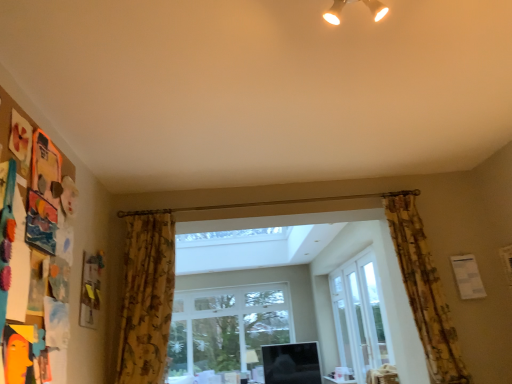
Question: In the image, is floral fabric curtain at right, marked as the 1th curtain in a right-to-left arrangement, positioned in front of or behind clear glass window at center, the first window from the left?

Choices:
 (A) behind
 (B) front

Answer: (B)

Question: Is floral fabric curtain at right, the 2th curtain from the left, taller or shorter than clear glass window at center, the first window from the left?

Choices:
 (A) short
 (B) tall

Answer: (A)

Question: Estimate the real-world distances between objects in this image. Which object is farther from the floral fabric curtain at left, marked as the second curtain in a right-to-left arrangement?

Choices:
 (A) white glossy spotlights at upper center
 (B) white glass door at center, arranged as the first window when viewed from the front
 (C) floral fabric curtain at right, marked as the 1th curtain in a right-to-left arrangement
 (D) white glass screen door at center
 (E) clear glass window at center, the first window from the left

Answer: (E)

Question: Estimate the real-world distances between objects in this image. Which object is farther from the floral fabric curtain at right, the 2th curtain from the left?

Choices:
 (A) white glass door at center, acting as the 2th window starting from the left
 (B) white glass screen door at center
 (C) floral fabric curtain at left, which ranks as the first curtain in left-to-right order
 (D) white glossy spotlights at upper center
 (E) clear glass window at center, arranged as the 2th window when viewed from the right

Answer: (E)